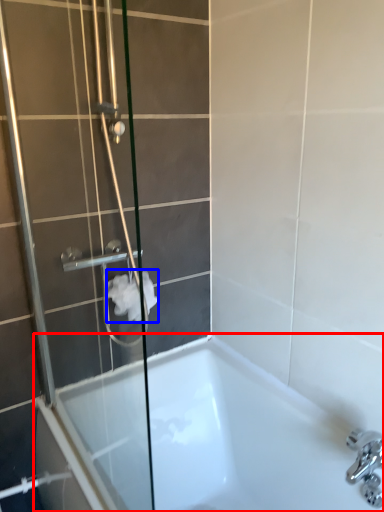
Question: Which of the following is the closest to the observer, bathtub (highlighted by a red box) or toilet paper (highlighted by a blue box)?

Choices:
 (A) bathtub
 (B) toilet paper

Answer: (A)